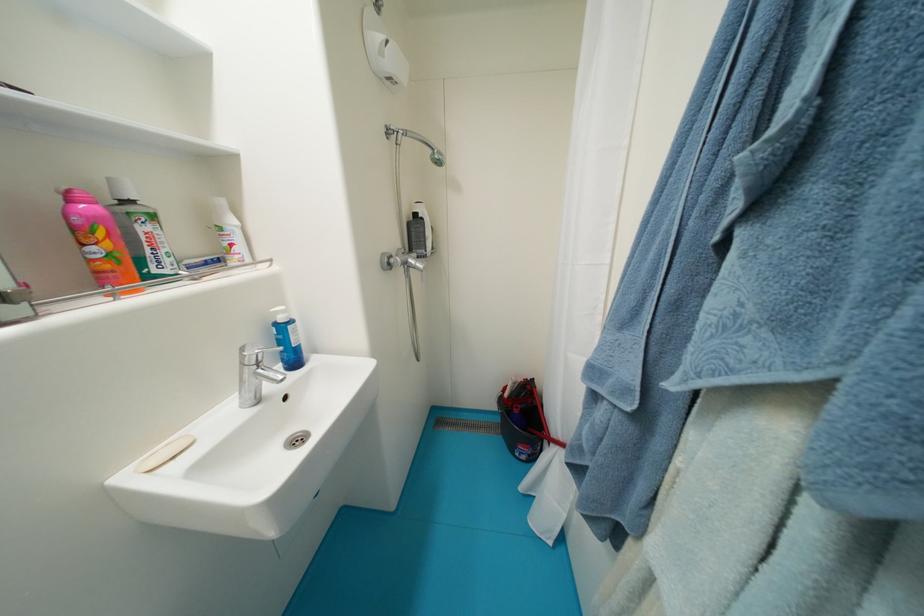
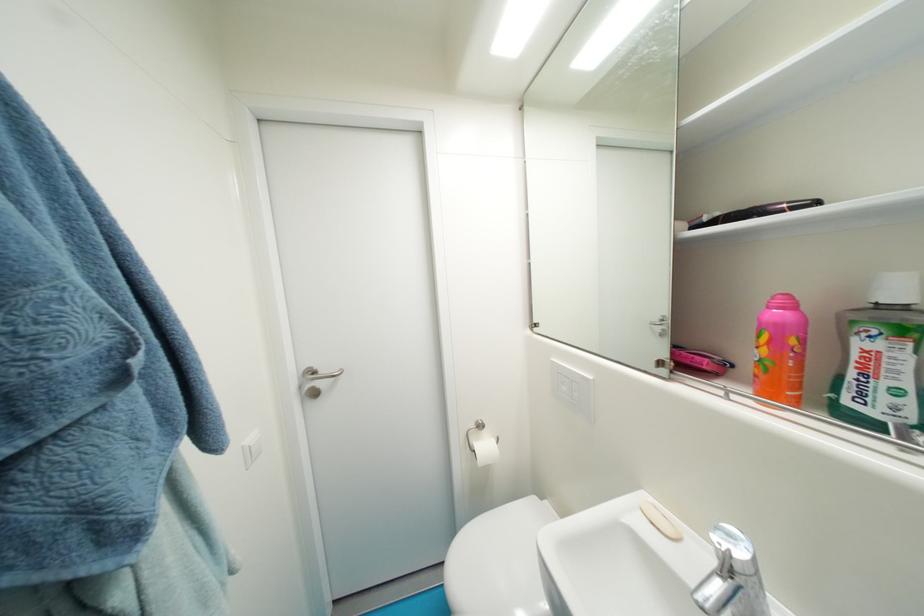
The point at (180, 460) is marked in the first image. Where is the corresponding point in the second image?

(659, 525)